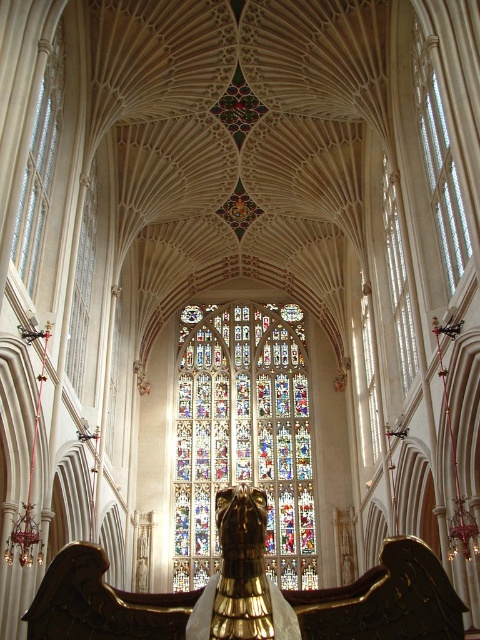
Find the location of `clear glass window at left`. clear glass window at left is located at coordinates (38, 168).

Is point (52, 100) positioned before point (78, 308)?

Yes, point (52, 100) is closer to viewer.

Is point (28, 193) positioned before point (78, 378)?

Yes, it is in front of point (78, 378).

Find the location of `clear glass window at left`. clear glass window at left is located at coordinates (38, 168).

The height and width of the screenshot is (640, 480). In order to click on clear glass window at right in this screenshot , I will do `click(397, 280)`.

Between point (402, 252) and point (84, 288), which one is positioned in front?

Point (402, 252) is more forward.

Between point (392, 268) and point (95, 227), which one is positioned in front?

Positioned in front is point (392, 268).

Where is `clear glass window at right`? clear glass window at right is located at coordinates (397, 280).

Is stained glass window at center to the left of clear glass window at upper right from the viewer's perspective?

Yes, stained glass window at center is to the left of clear glass window at upper right.

Who is positioned more to the left, stained glass window at center or clear glass window at upper right?

Positioned to the left is stained glass window at center.

Where is `stained glass window at center`? This screenshot has width=480, height=640. stained glass window at center is located at coordinates (243, 435).